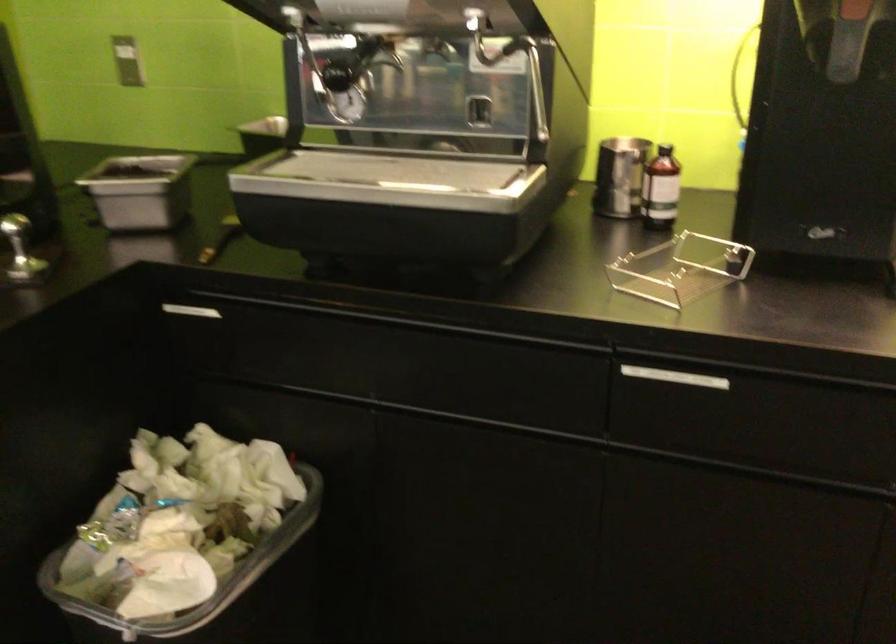
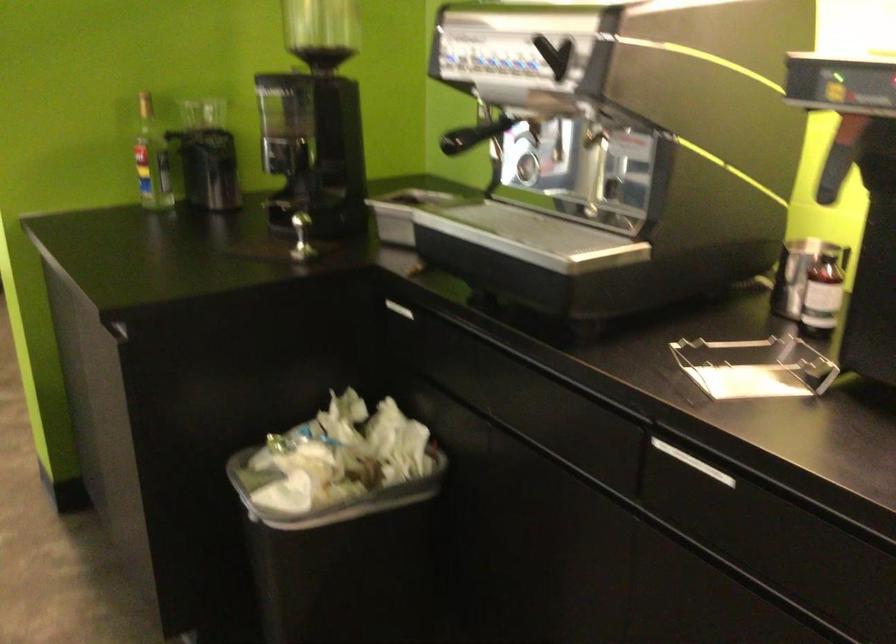
Where in the second image is the point corresponding to (535,87) from the first image?

(592, 171)